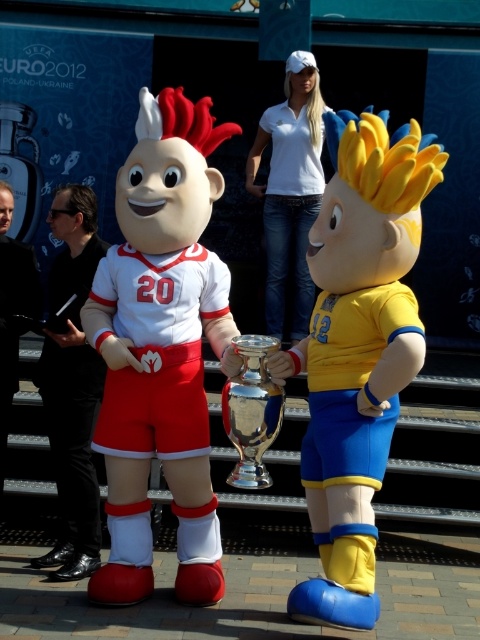
Question: Which of the following is the closest to the observer?

Choices:
 (A) matte white mascot at center
 (B) black leather jacket at left

Answer: (A)

Question: Which point appears farthest from the camera in this image?

Choices:
 (A) (273, 340)
 (B) (57, 467)
 (C) (137, 420)
 (D) (1, 212)

Answer: (B)

Question: From the image, what is the correct spatial relationship of matte white mascot at center in relation to yellow matte jersey at center?

Choices:
 (A) right
 (B) left

Answer: (B)

Question: Is black shiny suit at left bigger than shiny silver trophy at center?

Choices:
 (A) yes
 (B) no

Answer: (A)

Question: Is yellow matte jersey at center below white cotton shirt at upper center?

Choices:
 (A) yes
 (B) no

Answer: (A)

Question: Which of these objects is positioned closest to the matte white mascot at center?

Choices:
 (A) yellow matte jersey at center
 (B) black shiny suit at left
 (C) black leather jacket at left

Answer: (B)